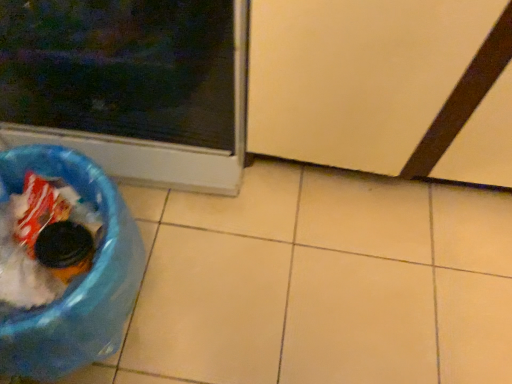
Describe the element at coordinates (76, 280) in the screenshot. I see `blue plastic recycling bin at lower left` at that location.

What do you see at coordinates (384, 86) in the screenshot? This screenshot has width=512, height=384. I see `transparent plastic screen door at lower right` at bounding box center [384, 86].

Where is `matte plastic trash can at lower left`? The width and height of the screenshot is (512, 384). matte plastic trash can at lower left is located at coordinates (130, 86).

Consider the image. Is matte plastic trash can at lower left shorter than transparent plastic screen door at lower right?

No.

Looking at this image, is matte plastic trash can at lower left positioned beyond the bounds of transparent plastic screen door at lower right?

Yes.

Where is `screen door below the matte plastic trash can at lower left (from a real-world perspective)`? Image resolution: width=512 pixels, height=384 pixels. screen door below the matte plastic trash can at lower left (from a real-world perspective) is located at coordinates (384, 86).

From the image's perspective, is matte plastic trash can at lower left located above or below transparent plastic screen door at lower right?

Based on their image positions, matte plastic trash can at lower left is located above transparent plastic screen door at lower right.

Is blue plastic recycling bin at lower left aimed at transparent plastic screen door at lower right?

No, blue plastic recycling bin at lower left is not facing towards transparent plastic screen door at lower right.

From a real-world perspective, does blue plastic recycling bin at lower left sit lower than transparent plastic screen door at lower right?

Correct, in the physical world, blue plastic recycling bin at lower left is lower than transparent plastic screen door at lower right.

From the image's perspective, is blue plastic recycling bin at lower left above transparent plastic screen door at lower right?

Actually, blue plastic recycling bin at lower left appears below transparent plastic screen door at lower right in the image.

You are a GUI agent. You are given a task and a screenshot of the screen. Output one action in this format:
    pyautogui.click(x=<x>, y=<y>)
    Task: Click on the recycling bin behind the transparent plastic screen door at lower right
    
    Given the screenshot: What is the action you would take?
    pyautogui.click(x=76, y=280)

Can you see matte plastic trash can at lower left touching blue plastic recycling bin at lower left?

matte plastic trash can at lower left is not next to blue plastic recycling bin at lower left, and they're not touching.

From the image's perspective, would you say matte plastic trash can at lower left is shown under blue plastic recycling bin at lower left?

No, from the image's perspective, matte plastic trash can at lower left is not below blue plastic recycling bin at lower left.

Is matte plastic trash can at lower left wider or thinner than blue plastic recycling bin at lower left?

matte plastic trash can at lower left is wider than blue plastic recycling bin at lower left.

Does point (77, 307) appear closer or farther from the camera than point (29, 71)?

Clearly, point (77, 307) is closer to the camera than point (29, 71).

Is blue plastic recycling bin at lower left next to matte plastic trash can at lower left?

No, blue plastic recycling bin at lower left is not making contact with matte plastic trash can at lower left.

Is blue plastic recycling bin at lower left taller or shorter than matte plastic trash can at lower left?

blue plastic recycling bin at lower left is shorter than matte plastic trash can at lower left.

You are a GUI agent. You are given a task and a screenshot of the screen. Output one action in this format:
    pyautogui.click(x=<x>, y=<y>)
    Task: Click on the home appliance above the blue plastic recycling bin at lower left (from a real-world perspective)
    The width and height of the screenshot is (512, 384).
    Given the screenshot: What is the action you would take?
    pyautogui.click(x=130, y=86)

From the image's perspective, which is below, transparent plastic screen door at lower right or matte plastic trash can at lower left?

From the image's view, transparent plastic screen door at lower right is below.

Could you tell me if transparent plastic screen door at lower right is turned towards matte plastic trash can at lower left?

No, transparent plastic screen door at lower right is not aimed at matte plastic trash can at lower left.

Where is `home appliance in front of the transparent plastic screen door at lower right`? home appliance in front of the transparent plastic screen door at lower right is located at coordinates (130, 86).

Which object is further away from the camera taking this photo, transparent plastic screen door at lower right or blue plastic recycling bin at lower left?

blue plastic recycling bin at lower left is further away from the camera.

Consider the image. Which of these two, transparent plastic screen door at lower right or blue plastic recycling bin at lower left, is thinner?

With smaller width is blue plastic recycling bin at lower left.

Between transparent plastic screen door at lower right and blue plastic recycling bin at lower left, which one appears on the left side from the viewer's perspective?

blue plastic recycling bin at lower left.

Based on the photo, is blue plastic recycling bin at lower left at the back of transparent plastic screen door at lower right?

No, transparent plastic screen door at lower right is not facing away from blue plastic recycling bin at lower left.

The image size is (512, 384). I want to click on home appliance above the transparent plastic screen door at lower right (from the image's perspective), so click(130, 86).

The width and height of the screenshot is (512, 384). Find the location of `screen door on the right of blue plastic recycling bin at lower left`. screen door on the right of blue plastic recycling bin at lower left is located at coordinates (384, 86).

Which object lies further to the anchor point transparent plastic screen door at lower right, matte plastic trash can at lower left or blue plastic recycling bin at lower left?

Among the two, blue plastic recycling bin at lower left is located further to transparent plastic screen door at lower right.

Looking at the image, which one is located closer to matte plastic trash can at lower left, transparent plastic screen door at lower right or blue plastic recycling bin at lower left?

blue plastic recycling bin at lower left is closer to matte plastic trash can at lower left.

Considering their positions, is blue plastic recycling bin at lower left positioned further to transparent plastic screen door at lower right than matte plastic trash can at lower left?

blue plastic recycling bin at lower left.

Consider the image. Looking at the image, which one is located closer to blue plastic recycling bin at lower left, matte plastic trash can at lower left or transparent plastic screen door at lower right?

Based on the image, matte plastic trash can at lower left appears to be nearer to blue plastic recycling bin at lower left.

From the image, which object appears to be nearer to matte plastic trash can at lower left, blue plastic recycling bin at lower left or transparent plastic screen door at lower right?

blue plastic recycling bin at lower left is closer to matte plastic trash can at lower left.

Which object lies further to the anchor point blue plastic recycling bin at lower left, transparent plastic screen door at lower right or matte plastic trash can at lower left?

transparent plastic screen door at lower right.

Image resolution: width=512 pixels, height=384 pixels. Find the location of `home appliance situated between blue plastic recycling bin at lower left and transparent plastic screen door at lower right from left to right`. home appliance situated between blue plastic recycling bin at lower left and transparent plastic screen door at lower right from left to right is located at coordinates (130, 86).